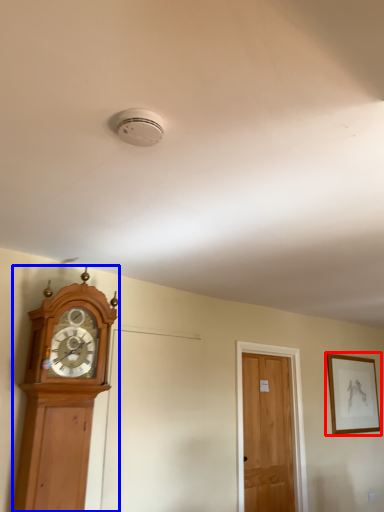
Question: Among these objects, which one is farthest to the camera, picture frame (highlighted by a red box) or wall clock (highlighted by a blue box)?

Choices:
 (A) picture frame
 (B) wall clock

Answer: (A)